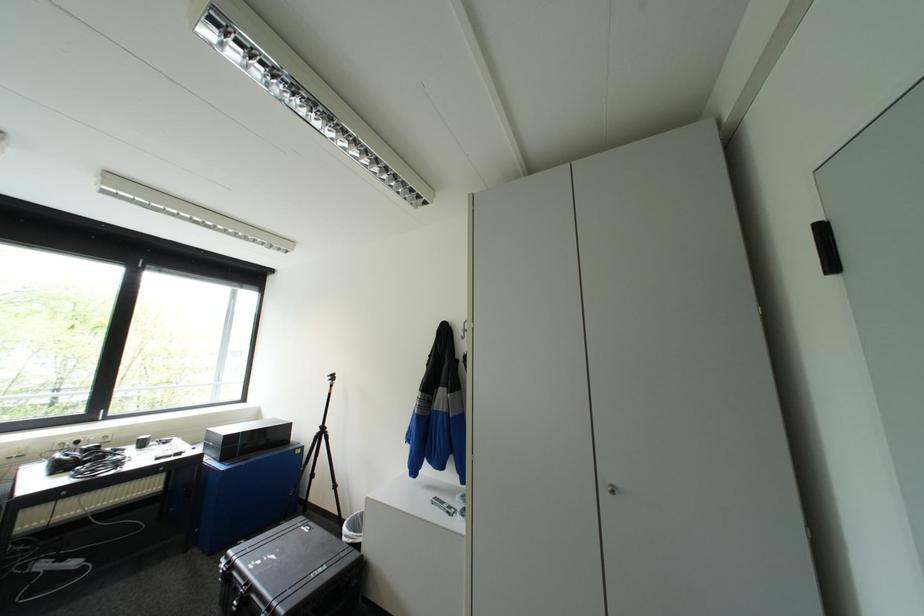
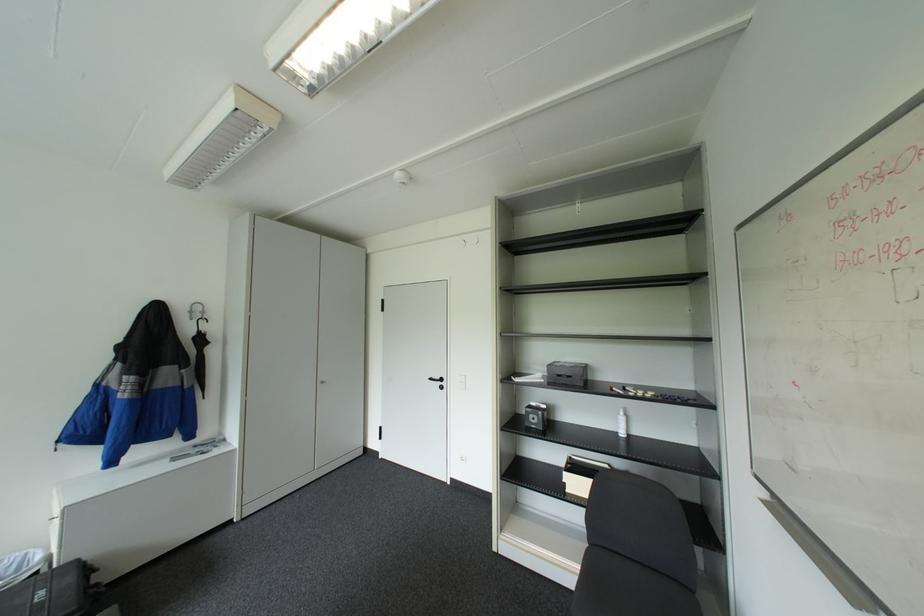
Find the pixel in the second image that matches (470,337) in the first image.

(200, 318)